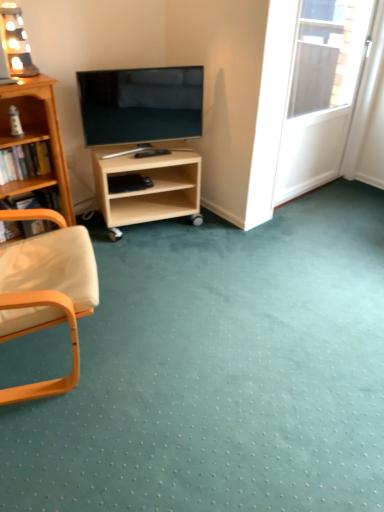
This screenshot has width=384, height=512. I want to click on free space on the front side of white glossy screen door at upper right, so click(x=329, y=224).